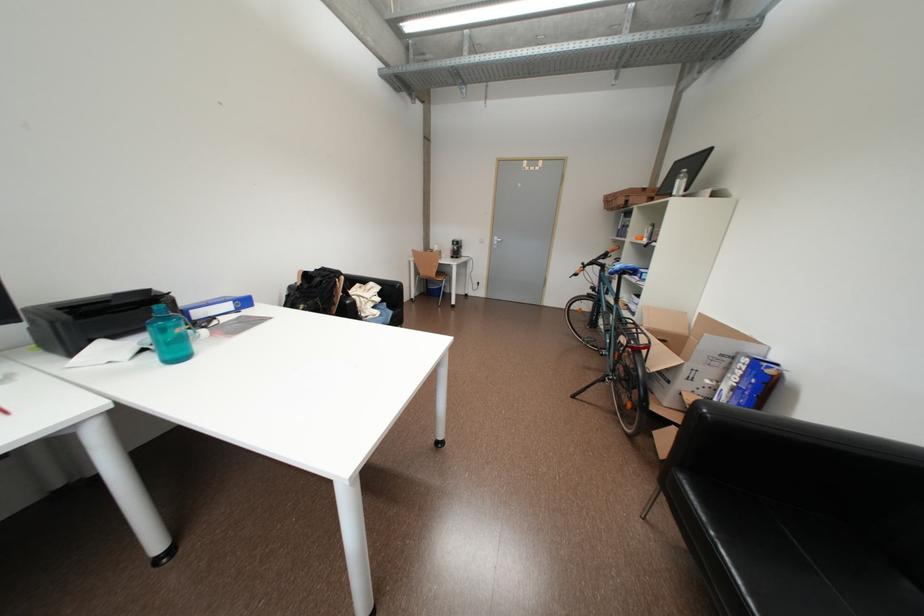
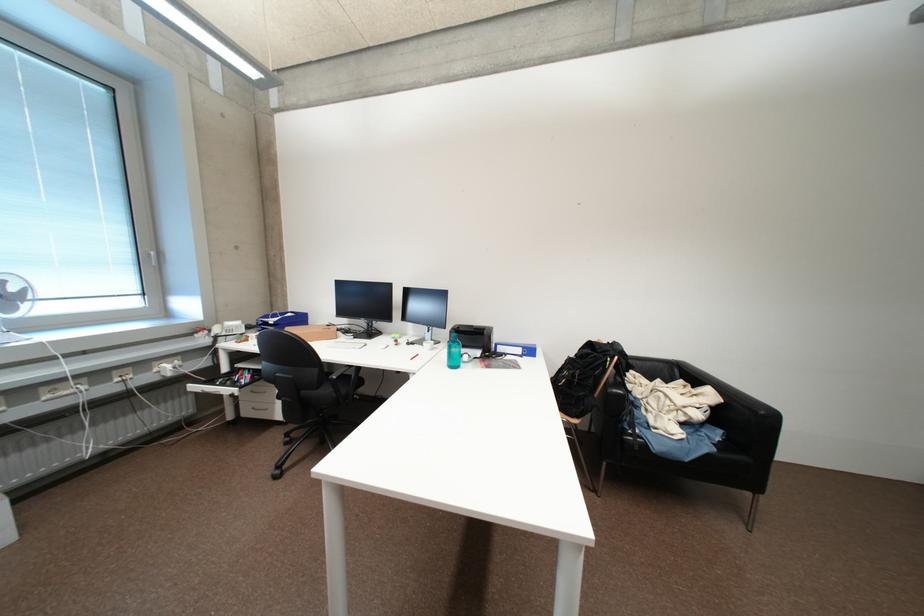
Find the pixel in the second image that matches the point at 393,306 in the first image.

(727, 434)